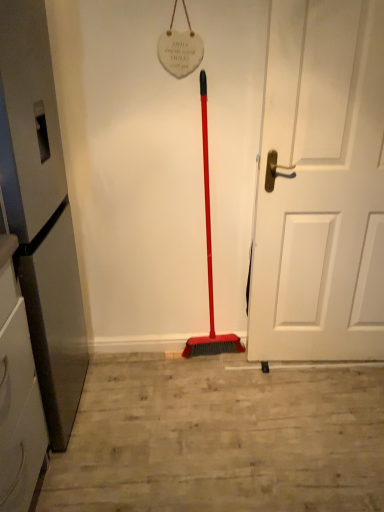
This screenshot has height=512, width=384. Describe the element at coordinates (321, 186) in the screenshot. I see `white matte door at center` at that location.

Measure the distance between white matte door at center and camera.

They are 4.86 feet apart.

Identify the location of white matte door at center. Image resolution: width=384 pixels, height=512 pixels. (321, 186).

This screenshot has width=384, height=512. Describe the element at coordinates (41, 213) in the screenshot. I see `metallic gray refrigerator at left` at that location.

This screenshot has width=384, height=512. What are the coordinates of `metallic gray refrigerator at left` in the screenshot? It's located at (41, 213).

I want to click on white matte door at center, so click(321, 186).

Is white matte door at center to the left or to the right of metallic gray refrigerator at left in the image?

In the image, white matte door at center appears on the right side of metallic gray refrigerator at left.

Relative to metallic gray refrigerator at left, is white matte door at center in front or behind?

white matte door at center is positioned farther from the viewer than metallic gray refrigerator at left.

Is point (316, 113) in front of point (34, 240)?

No.

From the image's perspective, which one is positioned lower, white matte door at center or metallic gray refrigerator at left?

metallic gray refrigerator at left, from the image's perspective.

From a real-world perspective, is white matte door at center located higher than metallic gray refrigerator at left?

Indeed, from a real-world perspective, white matte door at center stands above metallic gray refrigerator at left.

Between white matte door at center and metallic gray refrigerator at left, which one has larger width?

metallic gray refrigerator at left.

Is white matte door at center shorter than metallic gray refrigerator at left?

Incorrect, the height of white matte door at center does not fall short of that of metallic gray refrigerator at left.

Which of these two, white matte door at center or metallic gray refrigerator at left, is smaller?

Smaller between the two is white matte door at center.

Is white matte door at center inside the boundaries of metallic gray refrigerator at left, or outside?

white matte door at center lies outside metallic gray refrigerator at left.

Is white matte door at center far from metallic gray refrigerator at left?

No, white matte door at center is not far away from metallic gray refrigerator at left.

Is metallic gray refrigerator at left at the back of white matte door at center?

That's not correct — white matte door at center is not looking away from metallic gray refrigerator at left.

You are a GUI agent. You are given a task and a screenshot of the screen. Output one action in this format:
    pyautogui.click(x=<x>, y=<y>)
    Task: Click on the appliance lying on the left of white matte door at center
    
    Given the screenshot: What is the action you would take?
    pyautogui.click(x=41, y=213)

Between metallic gray refrigerator at left and white matte door at center, which one appears on the right side from the viewer's perspective?

Positioned to the right is white matte door at center.

Is metallic gray refrigerator at left closer to camera compared to white matte door at center?

Yes, it is.

Is point (15, 54) positioned after point (336, 312)?

That is False.

From the image's perspective, is metallic gray refrigerator at left positioned above or below white matte door at center?

metallic gray refrigerator at left is below white matte door at center.

From a real-world perspective, which is physically above, metallic gray refrigerator at left or white matte door at center?

white matte door at center, from a real-world perspective.

Considering the relative sizes of metallic gray refrigerator at left and white matte door at center in the image provided, is metallic gray refrigerator at left thinner than white matte door at center?

No.

Between metallic gray refrigerator at left and white matte door at center, which one has less height?

With less height is metallic gray refrigerator at left.

Does metallic gray refrigerator at left have a larger size compared to white matte door at center?

Yes.

Would you say metallic gray refrigerator at left is outside white matte door at center?

Absolutely, metallic gray refrigerator at left is external to white matte door at center.

Based on the photo, is metallic gray refrigerator at left positioned far away from white matte door at center?

No, metallic gray refrigerator at left is not far from white matte door at center.

Is metallic gray refrigerator at left facing towards white matte door at center?

Yes, metallic gray refrigerator at left is oriented towards white matte door at center.

What's the angular difference between metallic gray refrigerator at left and white matte door at center's facing directions?

The angle between the facing direction of metallic gray refrigerator at left and the facing direction of white matte door at center is 92.1 degrees.

The width and height of the screenshot is (384, 512). I want to click on appliance that appears in front of the white matte door at center, so click(41, 213).

This screenshot has width=384, height=512. Identify the location of appliance lying in front of the white matte door at center. (41, 213).

Find the location of a particular element. appliance below the white matte door at center (from a real-world perspective) is located at coordinates [x=41, y=213].